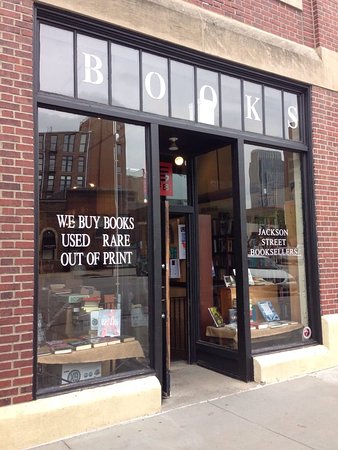
At what (x,y) coordinates should I click in order to perform the action: click on light. Please return your answer as a coordinate pair (x, y). Looking at the image, I should click on pyautogui.click(x=181, y=161), pyautogui.click(x=174, y=147), pyautogui.click(x=144, y=202), pyautogui.click(x=91, y=185), pyautogui.click(x=74, y=189).